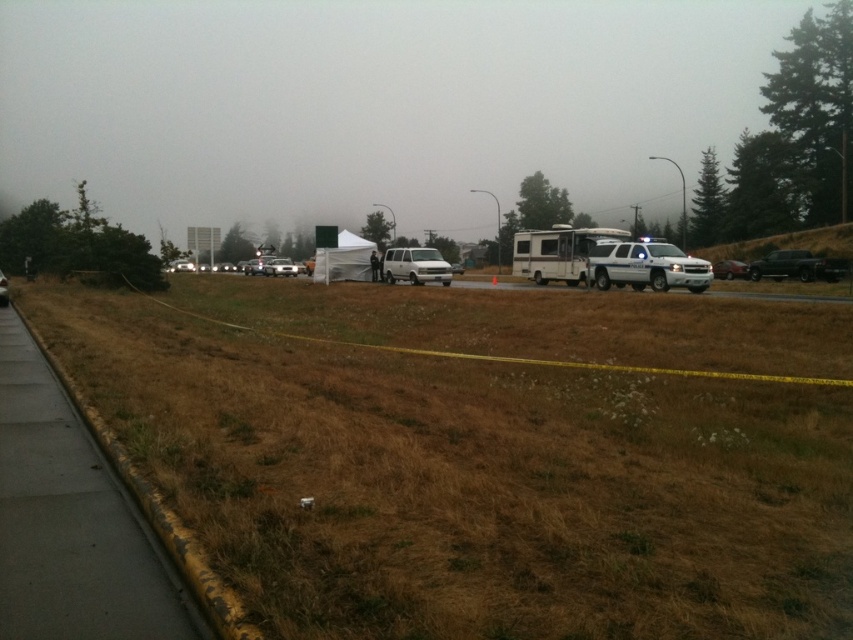
You are a delivery person carrying a large package that is 10 feet long. You need to place it on the ground between the brown dry grass at lower left and the yellow caution tape in the middle. Will the package fit in that space?

The space between the brown dry grass at lower left and the yellow caution tape in the middle is 10.89 feet, so the 10 feet long package will fit with some extra space remaining.

You are a delivery driver who needs to park your vehicle in the parking lot near the white glossy suv at right and white matte van at center. Which vehicle will require more space to park?

The white glossy suv at right requires more space to park because it has a larger size compared to the white matte van at center.

You are a delivery person trying to park your white glossy suv at right in the area near the brown dry grass at lower left. Is there enough space between the grass and the curb to park the SUV without damaging the grass?

The brown dry grass at lower left might be wider than the white glossy suv at right, so there could be enough space to park the SUV without damaging the grass. However, since the grass is dry and brown, it might not be healthy enough to withstand vehicle traffic, so caution is advised.